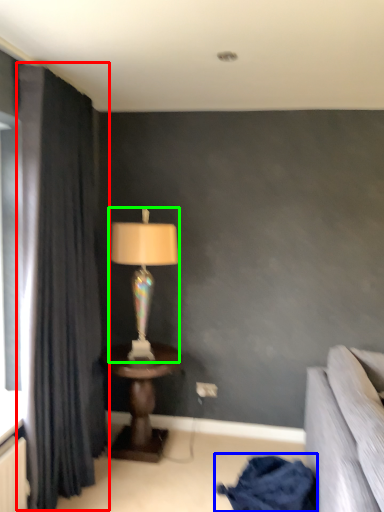
Question: Considering the real-world distances, which object is closest to curtain (highlighted by a red box)? blanket (highlighted by a blue box) or lamp (highlighted by a green box).

Choices:
 (A) blanket
 (B) lamp

Answer: (B)